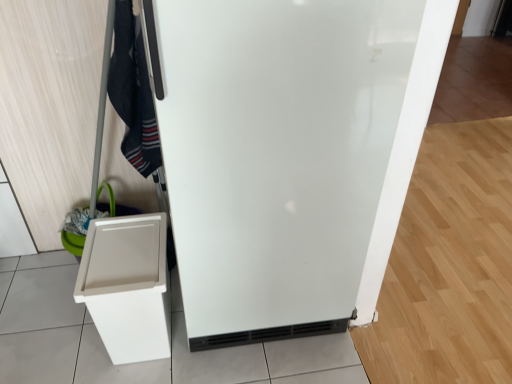
Locate an element on the screen. This screenshot has width=512, height=384. vacant point to the right of white glossy refrigerator at center is located at coordinates (420, 308).